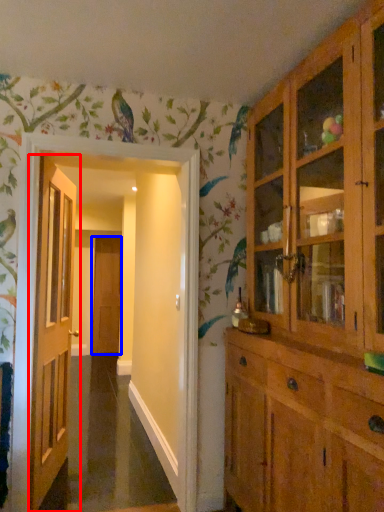
Question: Which of the following is the closest to the observer, door (highlighted by a red box) or door (highlighted by a blue box)?

Choices:
 (A) door
 (B) door

Answer: (A)